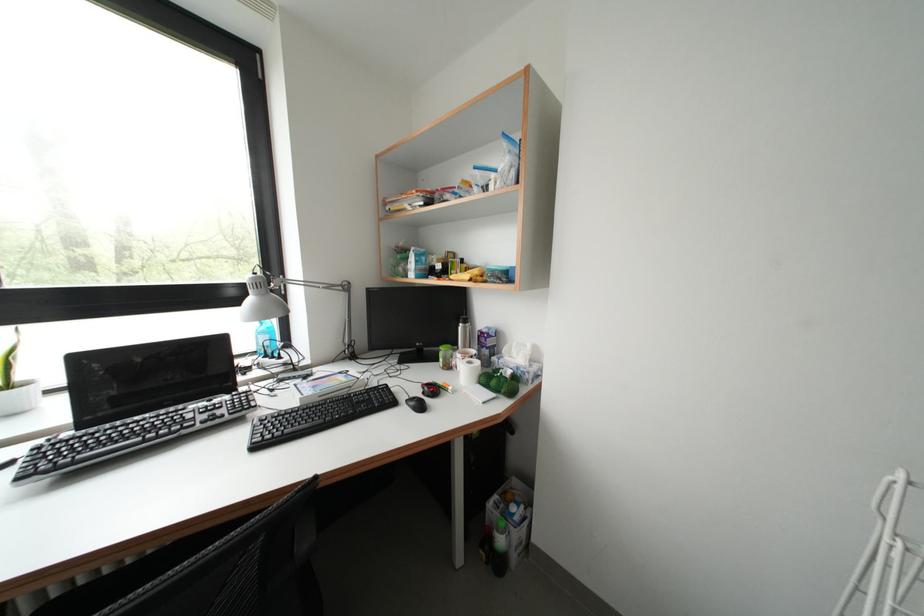
Where is `gray lamp head`? Image resolution: width=924 pixels, height=616 pixels. gray lamp head is located at coordinates (261, 300).